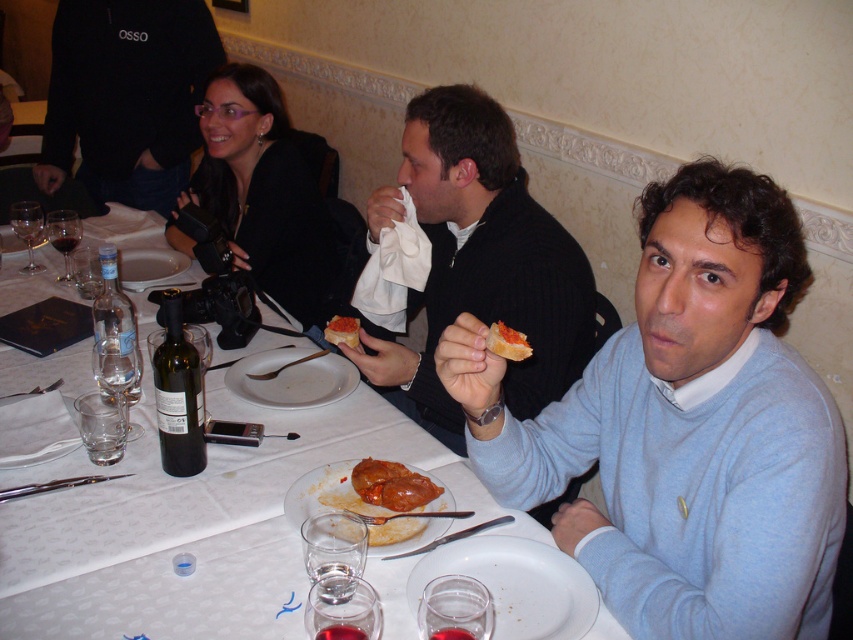
Can you confirm if light blue sweater at center is positioned to the right of smooth tomato paste at center?

Correct, you'll find light blue sweater at center to the right of smooth tomato paste at center.

In order to click on light blue sweater at center in this screenshot , I will do `click(685, 426)`.

Identify the location of light blue sweater at center. This screenshot has height=640, width=853. (685, 426).

Where is `light blue sweater at center`? Image resolution: width=853 pixels, height=640 pixels. light blue sweater at center is located at coordinates (685, 426).

Does meat with tomato sauce at center have a greater width compared to smooth tomato paste spread at center?

Yes.

Can you confirm if meat with tomato sauce at center is shorter than smooth tomato paste spread at center?

In fact, meat with tomato sauce at center may be taller than smooth tomato paste spread at center.

Between point (381, 541) and point (498, 330), which one is positioned in front?

Point (498, 330) is more forward.

Locate an element on the screen. The height and width of the screenshot is (640, 853). meat with tomato sauce at center is located at coordinates (341, 492).

You are a GUI agent. You are given a task and a screenshot of the screen. Output one action in this format:
    pyautogui.click(x=<x>, y=<y>)
    Task: Click on the smooth tomato paste spread at center
    This screenshot has width=853, height=640.
    Given the screenshot: What is the action you would take?
    pyautogui.click(x=508, y=342)

Between smooth tomato paste spread at center and smooth tomato paste at center, which one has more height?

Standing taller between the two is smooth tomato paste at center.

Which is in front, point (485, 340) or point (338, 317)?

Point (485, 340) is in front.

You are a GUI agent. You are given a task and a screenshot of the screen. Output one action in this format:
    pyautogui.click(x=<x>, y=<y>)
    Task: Click on the smooth tomato paste spread at center
    
    Given the screenshot: What is the action you would take?
    pyautogui.click(x=508, y=342)